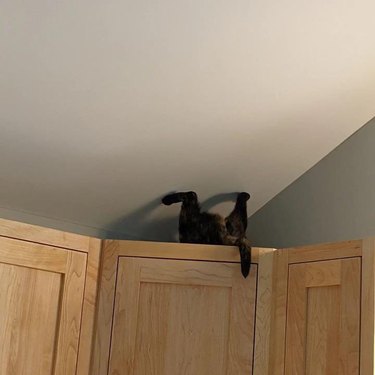
This screenshot has width=375, height=375. Find the location of `space of cabinet door`. space of cabinet door is located at coordinates (255, 322).